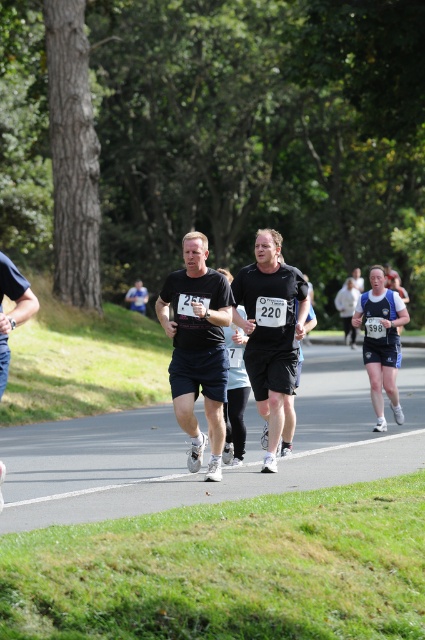
Question: Among these objects, which one is nearest to the camera?

Choices:
 (A) black matte t-shirt at center
 (B) black matte shorts at left
 (C) black matte running shirt at center
 (D) blue fabric shirt at center

Answer: (B)

Question: Which object is the farthest from the blue fabric shirt at center?

Choices:
 (A) black matte running shirt at center
 (B) black matte t-shirt at center
 (C) black matte shorts at left

Answer: (C)

Question: Is black matte t-shirt at center positioned at the back of black matte shorts at left?

Choices:
 (A) yes
 (B) no

Answer: (A)

Question: Based on their relative distances, which object is farther from the blue fabric shorts at right?

Choices:
 (A) black matte t-shirt at center
 (B) blue fabric shirt at center
 (C) black matte shorts at left
 (D) black matte running shirt at center

Answer: (B)

Question: Is blue fabric shorts at right below blue fabric shirt at center?

Choices:
 (A) yes
 (B) no

Answer: (A)

Question: Does blue fabric shorts at right have a larger size compared to black matte shorts at left?

Choices:
 (A) no
 (B) yes

Answer: (B)